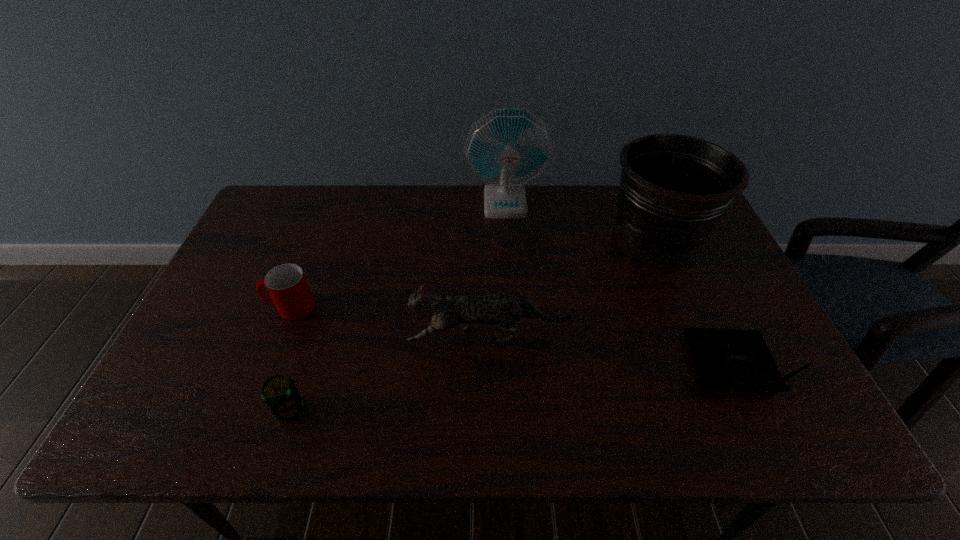
The height and width of the screenshot is (540, 960). I want to click on free space that satisfies the following two spatial constraints: 1. in front of the fan to face the airflow; 2. on the right side of the bucket, so click(x=508, y=239).

You are a GUI agent. You are given a task and a screenshot of the screen. Output one action in this format:
    pyautogui.click(x=<x>, y=<y>)
    Task: Click on the vacant space that satisfies the following two spatial constraints: 1. in front of the tallest object to face the airflow; 2. on the left side of the bucket
    
    Given the screenshot: What is the action you would take?
    pyautogui.click(x=508, y=239)

At what (x,y) coordinates should I click in order to perform the action: click on blank space that satisfies the following two spatial constraints: 1. on the face of the router; 2. on the right side of the cat. Please return your answer as a coordinate pair (x, y). Looking at the image, I should click on (489, 368).

You are a GUI agent. You are given a task and a screenshot of the screen. Output one action in this format:
    pyautogui.click(x=<x>, y=<y>)
    Task: Click on the free space that satisfies the following two spatial constraints: 1. in front of the tallest object to face the airflow; 2. on the left side of the bucket
    
    Given the screenshot: What is the action you would take?
    pyautogui.click(x=508, y=239)